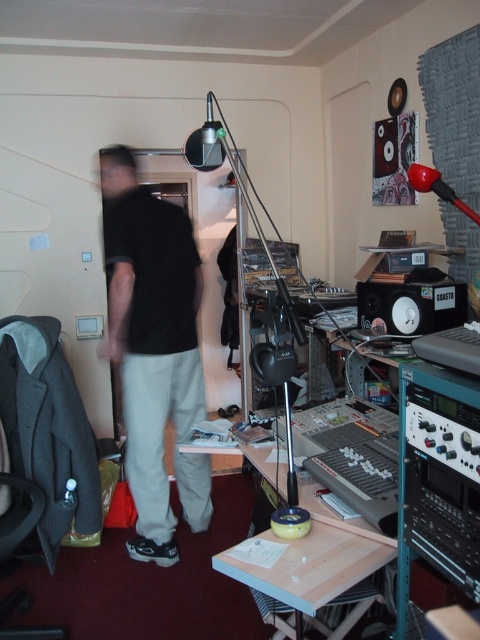
Question: Which object is farther from the camera taking this photo?

Choices:
 (A) black cotton pants at left
 (B) black plastic speaker at center-right

Answer: (A)

Question: Does black cotton pants at left appear under black plastic speaker at center-right?

Choices:
 (A) no
 (B) yes

Answer: (B)

Question: Which of the following is the farthest from the observer?

Choices:
 (A) (372, 300)
 (B) (105, 192)

Answer: (B)

Question: Is black cotton pants at left above black plastic speaker at center-right?

Choices:
 (A) no
 (B) yes

Answer: (A)

Question: Is black cotton pants at left to the left of black plastic speaker at center-right from the viewer's perspective?

Choices:
 (A) yes
 (B) no

Answer: (A)

Question: Which point is farther to the camera?

Choices:
 (A) (141, 218)
 (B) (462, 288)

Answer: (A)